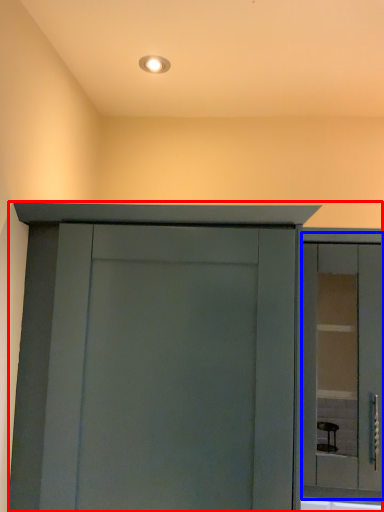
Question: Which object appears closest to the camera in this image, cupboard (highlighted by a red box) or window (highlighted by a blue box)?

Choices:
 (A) cupboard
 (B) window

Answer: (A)